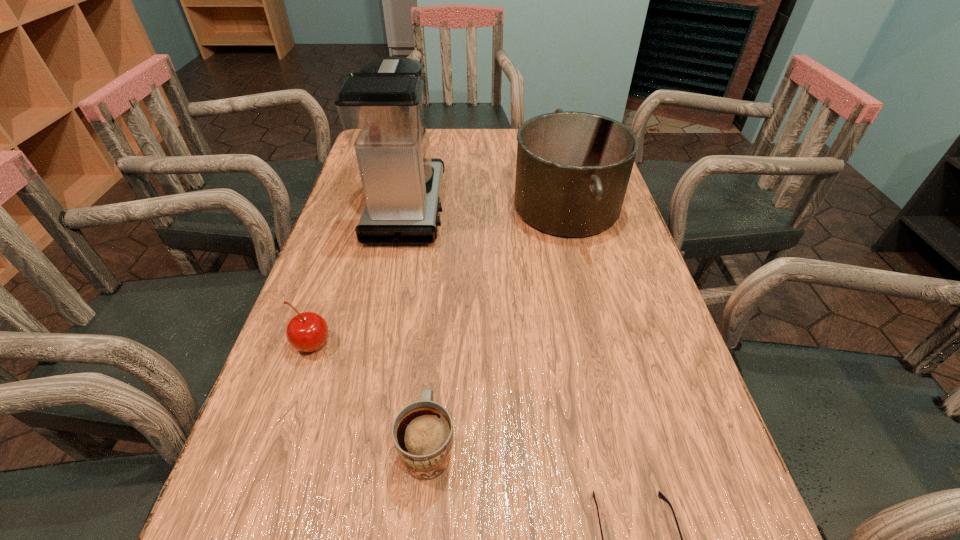
In order to click on coffee maker at the left edge in this screenshot , I will do `click(381, 109)`.

Where is `cherry that is at the left edge`? cherry that is at the left edge is located at coordinates (308, 331).

Identify the location of object located in the right edge section of the desktop. (573, 168).

The height and width of the screenshot is (540, 960). Find the location of `vacant space at the far edge of the desktop`. vacant space at the far edge of the desktop is located at coordinates (478, 129).

Locate an element on the screen. This screenshot has width=960, height=540. vacant area at the left edge of the desktop is located at coordinates (249, 456).

The image size is (960, 540). In order to click on free region at the right edge of the desktop in this screenshot , I will do `click(592, 245)`.

Locate an element on the screen. This screenshot has height=540, width=960. free space between the second tallest object and the mug is located at coordinates (497, 326).

Where is `free space between the third nearest object and the mug`? This screenshot has height=540, width=960. free space between the third nearest object and the mug is located at coordinates (371, 395).

Locate an element on the screen. This screenshot has height=540, width=960. vacant area between the third nearest object and the second nearest object is located at coordinates (371, 395).

Image resolution: width=960 pixels, height=540 pixels. I want to click on free point between the cherry and the coffee maker, so click(x=360, y=276).